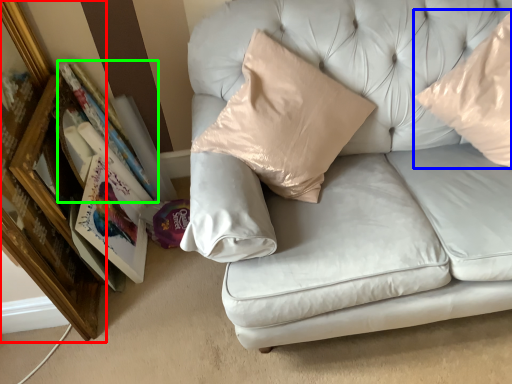
Question: Which object is positioned farthest from picture frame (highlighted by a red box)? Select from pillow (highlighted by a blue box) and book (highlighted by a green box).

Choices:
 (A) pillow
 (B) book

Answer: (A)